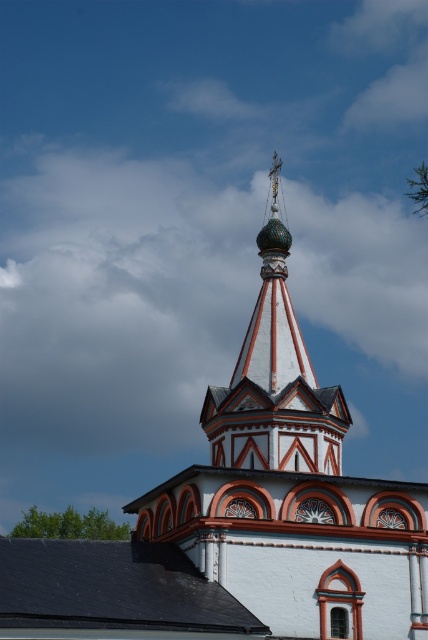
Between white painted wood bell tower at center and polished gold dome at center, which one is positioned lower?

white painted wood bell tower at center

Consider the image. Who is shorter, white painted wood bell tower at center or polished gold dome at center?

polished gold dome at center is shorter.

Which is behind, point (252, 324) or point (273, 339)?

Point (252, 324)

Locate an element on the screen. The width and height of the screenshot is (428, 640). white painted wood bell tower at center is located at coordinates (275, 380).